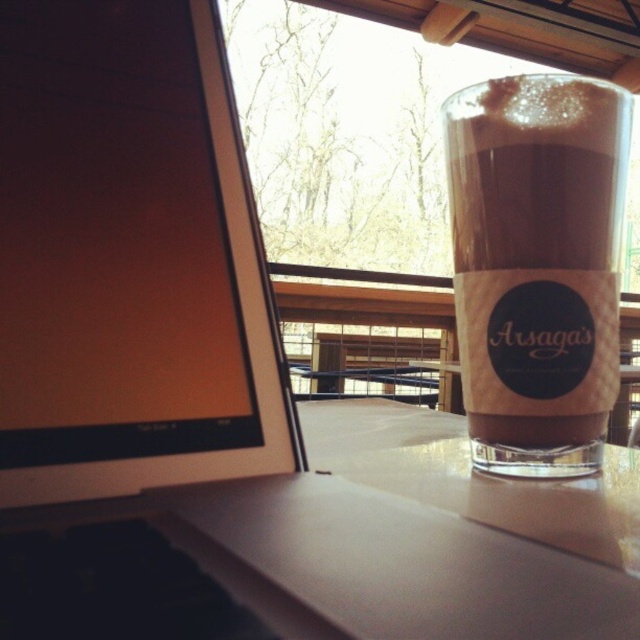
You are sitting at a table in a cozy indoor setting and see two points marked in the scene. The first point is at coordinate point (44,476) and the second is at coordinate point (484,140). Which point is closer to you?

Point (44,476) is closer to the viewer than point (484,140).

You are sitting at a table in a cozy indoor setting. You need to reach for your brown frothy beverage at right but want to avoid knocking over the matte black monitor at left. Based on their positions, which object is closer to you?

The matte black monitor at left is closer to you since it is positioned in front of the brown frothy beverage at right, making it the nearer object.

You are sitting at the table with the glass cup and notice the matte black monitor at left. If you want to reach the monitor from your current position, which direction should you move your hand?

Since the matte black monitor at left is located at point 0.406 on the x and 0.203 on the y, you should move your hand to the left and slightly forward to reach it.